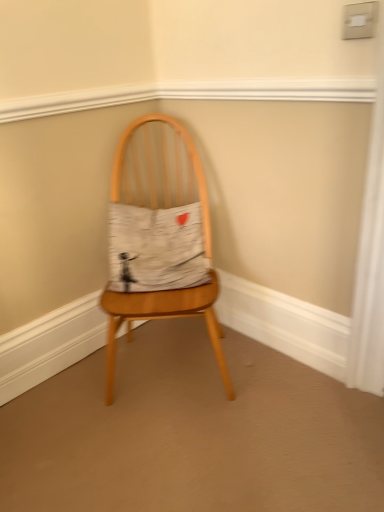
The image size is (384, 512). Describe the element at coordinates (159, 236) in the screenshot. I see `wooden chair at center` at that location.

At what (x,y) coordinates should I click in order to perform the action: click on wooden chair at center. Please return your answer as a coordinate pair (x, y). The width and height of the screenshot is (384, 512). Looking at the image, I should click on (159, 236).

Describe the element at coordinates (156, 248) in the screenshot. I see `white cotton cushion at center` at that location.

This screenshot has width=384, height=512. What are the coordinates of `white cotton cushion at center` in the screenshot? It's located at (156, 248).

Identify the location of wooden chair at center. Image resolution: width=384 pixels, height=512 pixels. (159, 236).

Visually, is wooden chair at center positioned to the left or to the right of white cotton cushion at center?

In the image, wooden chair at center appears on the right side of white cotton cushion at center.

Is wooden chair at center closer to the viewer compared to white cotton cushion at center?

Yes, the depth of wooden chair at center is less than that of white cotton cushion at center.

Which is closer, (196,154) or (145,215)?

The point (145,215) is more forward.

From the image's perspective, does wooden chair at center appear lower than white cotton cushion at center?

Yes, from the image's perspective, wooden chair at center is below white cotton cushion at center.

From a real-world perspective, is wooden chair at center positioned under white cotton cushion at center based on gravity?

Indeed, from a real-world perspective, wooden chair at center is positioned beneath white cotton cushion at center.

Can you confirm if wooden chair at center is wider than white cotton cushion at center?

Indeed, wooden chair at center has a greater width compared to white cotton cushion at center.

Is wooden chair at center taller than white cotton cushion at center?

Correct, wooden chair at center is much taller as white cotton cushion at center.

Which of these two, wooden chair at center or white cotton cushion at center, is smaller?

white cotton cushion at center is smaller.

Is wooden chair at center outside of white cotton cushion at center?

Yes.

Is wooden chair at center next to white cotton cushion at center?

Yes, wooden chair at center is beside white cotton cushion at center.

Could you tell me if wooden chair at center is turned towards white cotton cushion at center?

Yes, wooden chair at center is aimed at white cotton cushion at center.

Can you tell me how much wooden chair at center and white cotton cushion at center differ in facing direction?

1.88 degrees separate the facing orientations of wooden chair at center and white cotton cushion at center.

Measure the distance from wooden chair at center to white cotton cushion at center.

wooden chair at center is 3.10 inches away from white cotton cushion at center.

I want to click on chair to the right of white cotton cushion at center, so click(159, 236).

Does white cotton cushion at center appear on the right side of wooden chair at center?

No.

Which object is further away from the camera taking this photo, white cotton cushion at center or wooden chair at center?

white cotton cushion at center is further from the camera.

Which is in front, point (194, 272) or point (151, 283)?

The point (151, 283) is closer to the camera.

From the image's perspective, which one is positioned lower, white cotton cushion at center or wooden chair at center?

From the image's view, wooden chair at center is below.

From a real-world perspective, which object stands above the other?

From a 3D spatial view, white cotton cushion at center is above.

Considering the sizes of white cotton cushion at center and wooden chair at center in the image, is white cotton cushion at center wider or thinner than wooden chair at center?

In the image, white cotton cushion at center appears to be more narrow than wooden chair at center.

Who is shorter, white cotton cushion at center or wooden chair at center?

With less height is white cotton cushion at center.

Does white cotton cushion at center have a smaller size compared to wooden chair at center?

Correct, white cotton cushion at center occupies less space than wooden chair at center.

Choose the correct answer: Is white cotton cushion at center inside wooden chair at center or outside it?

white cotton cushion at center is contained in wooden chair at center.

Looking at this image, is the surface of white cotton cushion at center in direct contact with wooden chair at center?

Yes, white cotton cushion at center is with wooden chair at center.

Is white cotton cushion at center oriented away from wooden chair at center?

Yes, wooden chair at center is at the back of white cotton cushion at center.

Can you tell me how much white cotton cushion at center and wooden chair at center differ in facing direction?

The angular difference between white cotton cushion at center and wooden chair at center is 1.88 degrees.

How much distance is there between white cotton cushion at center and wooden chair at center?

The distance of white cotton cushion at center from wooden chair at center is 3.10 inches.

What are the coordinates of `fabric above the wooden chair at center (from a real-world perspective)` in the screenshot? It's located at (156, 248).

Locate an element on the screen. The width and height of the screenshot is (384, 512). fabric above the wooden chair at center (from a real-world perspective) is located at coordinates (156, 248).

Identify the location of chair that is under the white cotton cushion at center (from a real-world perspective). This screenshot has width=384, height=512. (159, 236).